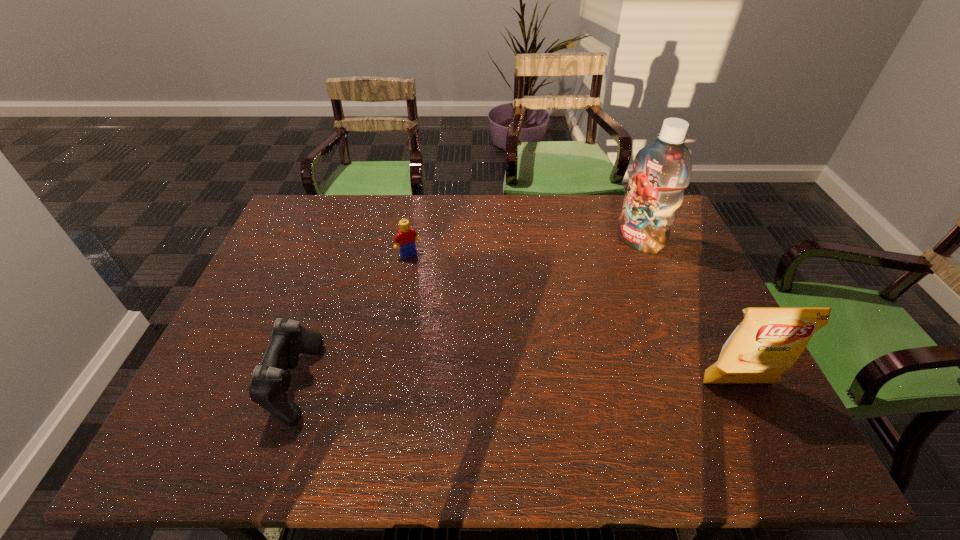
Where is `the leftmost object`? the leftmost object is located at coordinates (269, 382).

Image resolution: width=960 pixels, height=540 pixels. Find the location of `crisp (potato chip)`. crisp (potato chip) is located at coordinates (769, 340).

Locate an element on the screen. The width and height of the screenshot is (960, 540). shampoo is located at coordinates (662, 170).

Image resolution: width=960 pixels, height=540 pixels. Find the location of `the third object from right to left`. the third object from right to left is located at coordinates (406, 237).

This screenshot has width=960, height=540. I want to click on vacant space situated on the surface of the control with buttons, so click(x=204, y=383).

Identify the location of vacant space located on the surface of the control with buttons. This screenshot has height=540, width=960. (238, 383).

You are a GUI agent. You are given a task and a screenshot of the screen. Output one action in this format:
    pyautogui.click(x=<x>, y=<y>)
    Task: Click on the free region located on the surface of the control with buttons
    The image size is (960, 540).
    Given the screenshot: What is the action you would take?
    pyautogui.click(x=226, y=383)

Where is `vacant region located on the front label of the shampoo`? The image size is (960, 540). vacant region located on the front label of the shampoo is located at coordinates (618, 258).

Find the location of a particular element. This screenshot has width=960, height=540. free space located on the front label of the shampoo is located at coordinates (578, 289).

Locate an element on the screen. This screenshot has height=540, width=960. free region located on the front label of the shampoo is located at coordinates (588, 281).